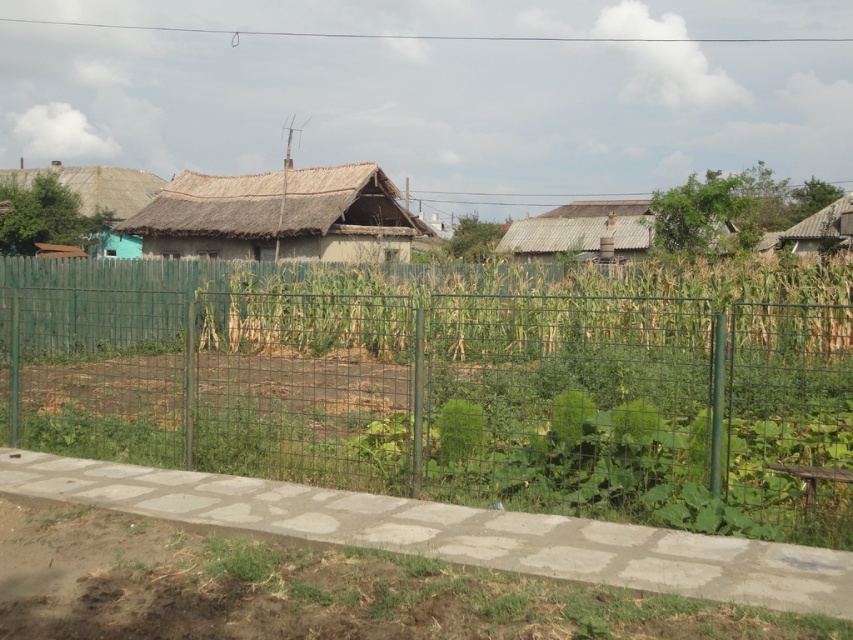
Question: Can you confirm if green wire mesh fence at center is smaller than rusty corrugated metal hut at center?

Choices:
 (A) yes
 (B) no

Answer: (A)

Question: Which point appears closest to the camera in this image?

Choices:
 (A) (830, 241)
 (B) (611, 234)

Answer: (A)

Question: Which of the following is the farthest from the observer?

Choices:
 (A) (767, 532)
 (B) (213, 227)
 (C) (793, 234)
 (D) (587, 216)

Answer: (D)

Question: Which of the following is the closest to the observer?

Choices:
 (A) (602, 202)
 (B) (840, 214)
 (C) (775, 403)
 (D) (170, 186)

Answer: (C)

Question: Does thatched straw hut at center appear on the left side of rusty corrugated metal hut at center?

Choices:
 (A) no
 (B) yes

Answer: (B)

Question: Is thatched straw hut at center to the left of rusty corrugated metal hut at center from the viewer's perspective?

Choices:
 (A) no
 (B) yes

Answer: (B)